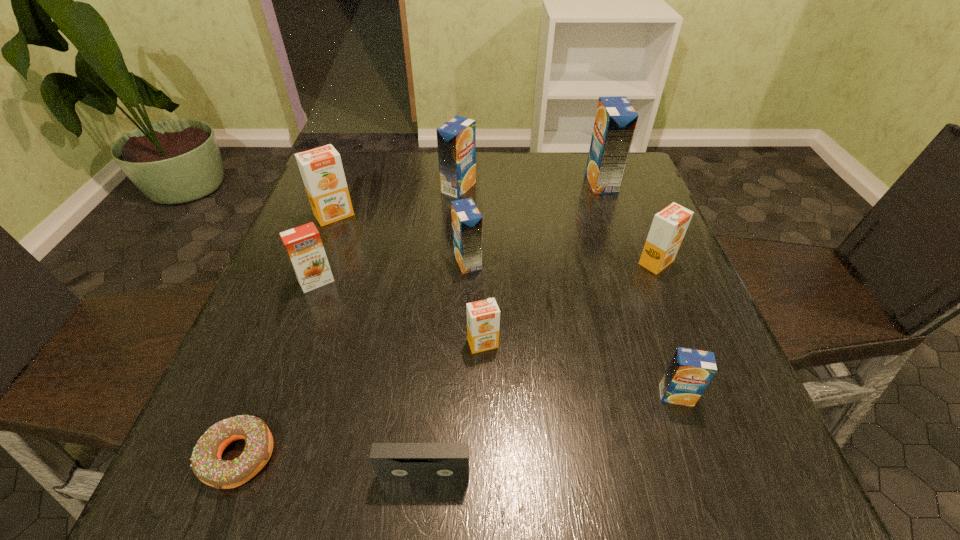
The image size is (960, 540). What are the coordinates of `free spot located 0.380m on the right of the fourth nearest object` in the screenshot? It's located at (702, 343).

Find the location of a particular element. free space located 0.290m on the right of the shortest object is located at coordinates (465, 456).

The width and height of the screenshot is (960, 540). What are the coordinates of `videotape at the near edge` in the screenshot? It's located at (393, 462).

Find the location of a particular element. The width and height of the screenshot is (960, 540). doughnut that is at the near edge is located at coordinates (207, 465).

The width and height of the screenshot is (960, 540). I want to click on doughnut positioned at the left edge, so coord(207,465).

Locate an element on the screen. This screenshot has height=540, width=960. object located at the near left corner is located at coordinates (207, 465).

Identify the location of object present at the far right corner. (615, 122).

Image resolution: width=960 pixels, height=540 pixels. Identify the location of vacant space at the far edge of the desktop. (487, 183).

The height and width of the screenshot is (540, 960). In the image, there is a desktop. Find the location of `vacant space at the near edge`. vacant space at the near edge is located at coordinates (453, 485).

In the image, there is a desktop. Where is `vacant space at the left edge`? vacant space at the left edge is located at coordinates (328, 306).